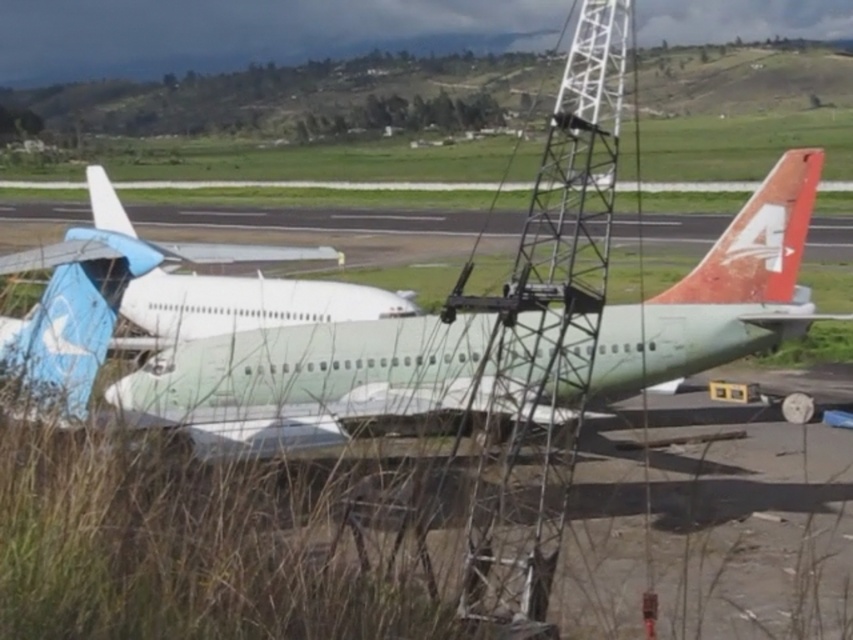
Question: Which point is farther to the camera?

Choices:
 (A) rusty orange tail fin at right
 (B) white matte airplane at center

Answer: (A)

Question: Can you confirm if white matte airplane at center is smaller than rusty orange tail fin at right?

Choices:
 (A) yes
 (B) no

Answer: (B)

Question: From the image, what is the correct spatial relationship of white matte airplane at center in relation to rusty orange tail fin at right?

Choices:
 (A) above
 (B) below

Answer: (B)

Question: Which of the following is the farthest from the observer?

Choices:
 (A) (753, 291)
 (B) (70, 316)

Answer: (A)

Question: In this image, where is white matte airplane at center located relative to rusty orange tail fin at right?

Choices:
 (A) below
 (B) above

Answer: (A)